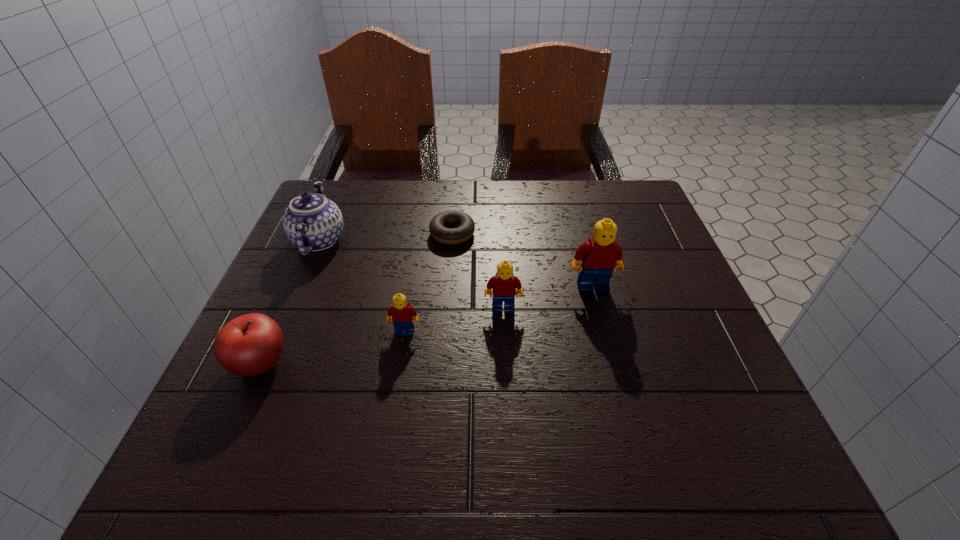
Observe the arrangement of all Legos in the image. To keep them evenly spaced, where would you place another Lego on the right? Please locate a free space. Please provide its 2D coordinates. Your answer should be formatted as a tuple, i.e. [(x, y)], where the tuple contains the x and y coordinates of a point satisfying the conditions above.

[(673, 268)]